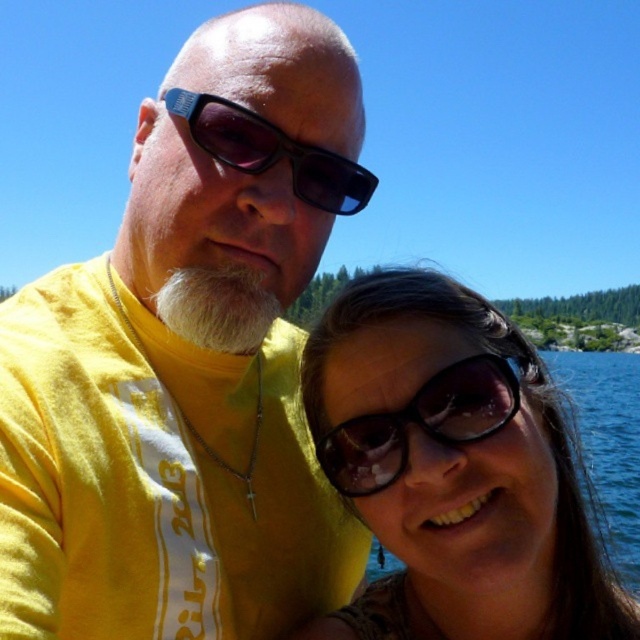
Describe the element at coordinates (424, 420) in the screenshot. I see `sunglasses at center` at that location.

Which is behind, point (465, 362) or point (300, 172)?

The point (300, 172) is more distant.

You are a GUI agent. You are given a task and a screenshot of the screen. Output one action in this format:
    pyautogui.click(x=<x>, y=<y>)
    Task: Click on the sunglasses at center
    The height and width of the screenshot is (640, 640).
    Given the screenshot: What is the action you would take?
    tap(424, 420)

Does yellow matte shirt at upper left appear over matte black sunglasses at upper center?

No, yellow matte shirt at upper left is not above matte black sunglasses at upper center.

Between yellow matte shirt at upper left and matte black sunglasses at upper center, which one appears on the left side from the viewer's perspective?

From the viewer's perspective, yellow matte shirt at upper left appears more on the left side.

You are a GUI agent. You are given a task and a screenshot of the screen. Output one action in this format:
    pyautogui.click(x=<x>, y=<y>)
    Task: Click on the yellow matte shirt at upper left
    This screenshot has width=640, height=640.
    Given the screenshot: What is the action you would take?
    pyautogui.click(x=188, y=362)

Between yellow matte shirt at upper left and sunglasses at center, which one is positioned lower?

sunglasses at center is below.

Is point (305, 566) positioned behind point (352, 490)?

Yes.

Does point (188, 173) lie in front of point (353, 492)?

No, it is behind (353, 492).

I want to click on yellow matte shirt at upper left, so click(x=188, y=362).